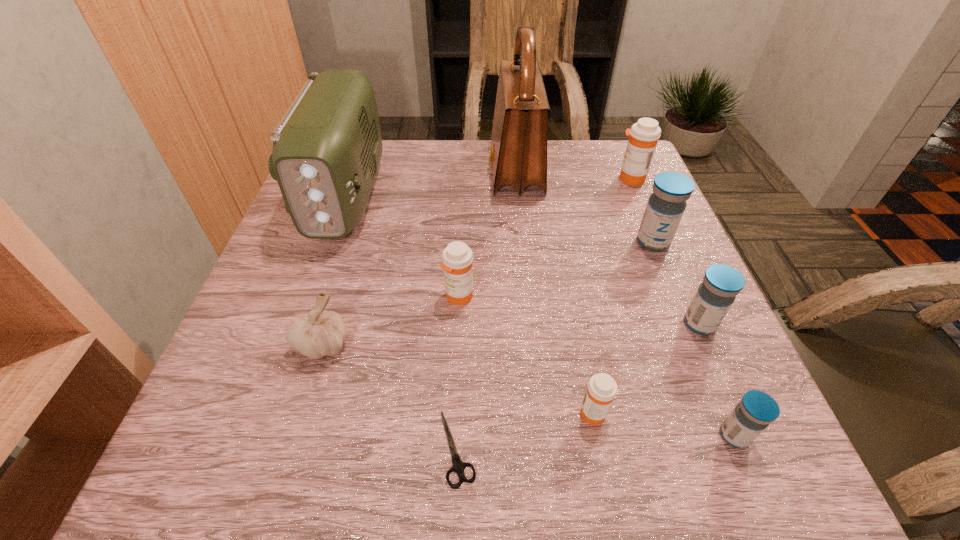
The width and height of the screenshot is (960, 540). I want to click on unoccupied area between the second farthest medicine and the second biggest blue medicine, so click(x=676, y=283).

Image resolution: width=960 pixels, height=540 pixels. I want to click on the sixth closest object relative to the second nearest orange medicine, so click(x=666, y=205).

Identify which object is the nearest to the second smallest blue medicine. Please provide its 2D coordinates. Your answer should be formatted as a tuple, i.e. [(x, y)], where the tuple contains the x and y coordinates of a point satisfying the conditions above.

[(756, 410)]

Identify which medicine is located as the fifth nearest to the second farthest blue medicine. Please provide its 2D coordinates. Your answer should be formatted as a tuple, i.e. [(x, y)], where the tuple contains the x and y coordinates of a point satisfying the conditions above.

[(644, 134)]

I want to click on medicine that is the third closest to the smallest blue medicine, so click(x=666, y=205).

The width and height of the screenshot is (960, 540). I want to click on orange medicine that can be found as the second closest to the leftmost medicine, so click(644, 134).

Select which orange medicine appears as the closest to the radio_receiver. Please provide its 2D coordinates. Your answer should be formatted as a tuple, i.e. [(x, y)], where the tuple contains the x and y coordinates of a point satisfying the conditions above.

[(457, 257)]

Point out which blue medicine is positioned as the nearest to the shoulder bag. Please provide its 2D coordinates. Your answer should be formatted as a tuple, i.e. [(x, y)], where the tuple contains the x and y coordinates of a point satisfying the conditions above.

[(666, 205)]

Select which blue medicine appears as the second closest to the shoulder bag. Please provide its 2D coordinates. Your answer should be formatted as a tuple, i.e. [(x, y)], where the tuple contains the x and y coordinates of a point satisfying the conditions above.

[(715, 295)]

This screenshot has width=960, height=540. Identify the location of free space that satisfies the following two spatial constraints: 1. on the front flap of the shoulder bag; 2. on the back side of the second biggest blue medicine. (531, 324).